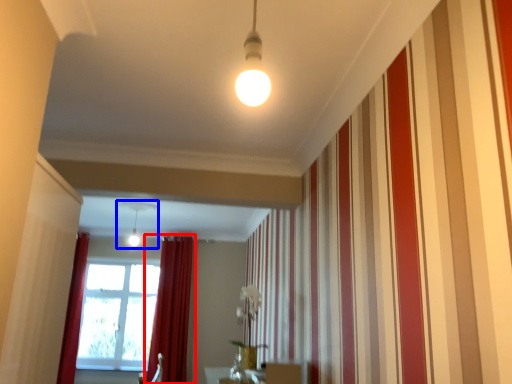
Question: Which of the following is the closest to the observer, curtain (highlighted by a red box) or light fixture (highlighted by a blue box)?

Choices:
 (A) curtain
 (B) light fixture

Answer: (B)